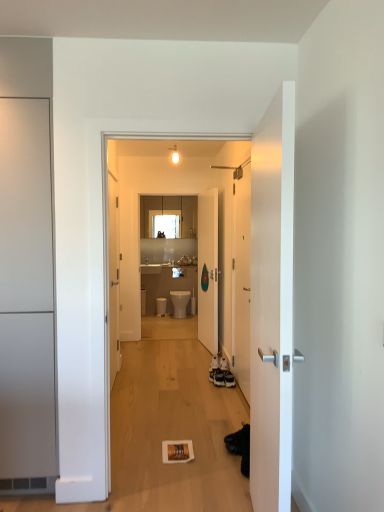
What do you see at coordinates (208, 270) in the screenshot?
I see `white glossy door at center, which is counted as the 1th door, starting from the back` at bounding box center [208, 270].

The width and height of the screenshot is (384, 512). What do you see at coordinates (241, 281) in the screenshot?
I see `white glossy door at center, the 2th door positioned from the back` at bounding box center [241, 281].

Locate an element on the screen. The height and width of the screenshot is (512, 384). white glossy door at center, the 4th door positioned from the left is located at coordinates (241, 281).

This screenshot has width=384, height=512. Identify the location of white glossy sink at center. tap(150, 267).

Considering the sizes of objects white glossy door at center, positioned as the 4th door in front-to-back order, and white matte door at left, which is the 4th door from right to left, in the image provided, who is shorter, white glossy door at center, positioned as the 4th door in front-to-back order, or white matte door at left, which is the 4th door from right to left,?

white glossy door at center, positioned as the 4th door in front-to-back order.

Considering the relative sizes of white glossy door at center, positioned as the 4th door in front-to-back order, and white matte door at left, which appears as the 3th door when viewed from the back, in the image provided, is white glossy door at center, positioned as the 4th door in front-to-back order, thinner than white matte door at left, which appears as the 3th door when viewed from the back,?

Correct, the width of white glossy door at center, positioned as the 4th door in front-to-back order, is less than that of white matte door at left, which appears as the 3th door when viewed from the back.

From the image's perspective, which one is positioned lower, white glossy door at center, placed as the 3th door when sorted from right to left, or white matte door at left, which is the 4th door from right to left?

white glossy door at center, placed as the 3th door when sorted from right to left, appears lower in the image.

Is white glossy door at center, which is counted as the 1th door, starting from the back, facing away from white matte door at left, which appears as the 3th door when viewed from the back?

No, white glossy door at center, which is counted as the 1th door, starting from the back,'s orientation is not away from white matte door at left, which appears as the 3th door when viewed from the back.

From the white glossy door at center, the 2th door positioned from the back, count the 1st door to the left and point to it. Please provide its 2D coordinates.

[(272, 303)]

Considering the points (248, 378) and (283, 132), which point is in front, point (248, 378) or point (283, 132)?

Positioned in front is point (283, 132).

Between white glossy door at center, the 2th door positioned from the back, and white glossy door at right, marked as the 2th door in a right-to-left arrangement, which one has less height?

Standing shorter between the two is white glossy door at right, marked as the 2th door in a right-to-left arrangement.

Looking at their sizes, would you say white glossy door at center, the 4th door positioned from the left, is wider or thinner than white glossy door at right, placed as the third door when sorted from left to right?

Clearly, white glossy door at center, the 4th door positioned from the left, has less width compared to white glossy door at right, placed as the third door when sorted from left to right.

I want to click on sink below the matte wood cabinets at upper center (from a real-world perspective), so click(x=150, y=267).

Is point (159, 266) positioned behind point (183, 217)?

That is False.

Considering the sizes of objects white glossy sink at center and matte wood cabinets at upper center in the image provided, who is wider, white glossy sink at center or matte wood cabinets at upper center?

white glossy sink at center is wider.

From the picture: From a real-world perspective, is white glossy sink at center located beneath matte wood cabinets at upper center?

Correct, in the physical world, white glossy sink at center is lower than matte wood cabinets at upper center.

From the image's perspective, which is below, white matte door at left, which appears as the first door when viewed from the left, or white glossy door at center, positioned as the 4th door in front-to-back order?

From the image's view, white glossy door at center, positioned as the 4th door in front-to-back order, is below.

Is white matte door at left, which is the 4th door from right to left, oriented away from white glossy door at center, which is counted as the 1th door, starting from the back?

That's not correct — white matte door at left, which is the 4th door from right to left, is not looking away from white glossy door at center, which is counted as the 1th door, starting from the back.

How many degrees apart are the facing directions of white matte door at left, which is the 4th door from right to left, and white glossy door at center, which is counted as the second door, starting from the left?

There is a 79.5-degree angle between the facing directions of white matte door at left, which is the 4th door from right to left, and white glossy door at center, which is counted as the second door, starting from the left.

Is white matte door at left, which is the 4th door from right to left, inside or outside of white glossy door at center, positioned as the 4th door in front-to-back order?

white matte door at left, which is the 4th door from right to left, exists outside the volume of white glossy door at center, positioned as the 4th door in front-to-back order.

Is white glossy door at right, acting as the 4th door starting from the back, turned away from white glossy sink at center?

white glossy door at right, acting as the 4th door starting from the back, is not turned away from white glossy sink at center.

Consider the image. Is white glossy door at right, placed as the third door when sorted from left to right, outside of white glossy sink at center?

white glossy door at right, placed as the third door when sorted from left to right, is positioned outside white glossy sink at center.

In terms of size, does white glossy door at right, placed as the third door when sorted from left to right, appear bigger or smaller than white glossy sink at center?

white glossy door at right, placed as the third door when sorted from left to right, is bigger than white glossy sink at center.

Can you confirm if white glossy door at right, placed as the first door when sorted from front to back, is positioned to the left of white glossy sink at center?

No.

Is the depth of white glossy sink at center greater than that of white glossy toilet at center?

Yes, white glossy sink at center is behind white glossy toilet at center.

Looking at this image, which point is more distant from viewer, [156,264] or [180,304]?

The point [156,264] is farther from the camera.

This screenshot has height=512, width=384. Find the location of `toilet on the right of white glossy sink at center`. toilet on the right of white glossy sink at center is located at coordinates (180, 302).

From the image's perspective, which object appears higher, matte wood cabinets at upper center or white glossy toilet at center?

matte wood cabinets at upper center, from the image's perspective.

Does point (140, 208) appear closer or farther from the camera than point (172, 296)?

Point (140, 208) is farther from the camera than point (172, 296).

How different are the orientations of matte wood cabinets at upper center and white glossy toilet at center in degrees?

The facing directions of matte wood cabinets at upper center and white glossy toilet at center are 0.71 degrees apart.

This screenshot has width=384, height=512. In order to click on the 2nd door above the white glossy door at center, placed as the 3th door when sorted from right to left (from a real-world perspective) in this screenshot , I will do `click(26, 298)`.

At what (x,y) coordinates should I click in order to perform the action: click on the 2nd door located beneath the white glossy door at center, the 2th door positioned from the back (from a real-world perspective). Please return your answer as a coordinate pair (x, y). The width and height of the screenshot is (384, 512). Looking at the image, I should click on (272, 303).

Considering their positions, is matte wood cabinets at upper center positioned closer to white glossy door at center, the 2th door positioned from the back, than white glossy sink at center?

matte wood cabinets at upper center lies closer to white glossy door at center, the 2th door positioned from the back, than the other object.

When comparing their distances from white glossy toilet at center, does white glossy door at center, the third door in the front-to-back sequence, or white glossy door at right, placed as the third door when sorted from left to right, seem closer?

white glossy door at center, the third door in the front-to-back sequence, lies closer to white glossy toilet at center than the other object.

Which object lies nearer to the anchor point matte wood cabinets at upper center, white glossy toilet at center or white glossy sink at center?

white glossy sink at center is positioned closer to the anchor matte wood cabinets at upper center.

When comparing their distances from white glossy door at right, marked as the 2th door in a right-to-left arrangement, does white glossy toilet at center or matte wood cabinets at upper center seem further?

Among the two, matte wood cabinets at upper center is located further to white glossy door at right, marked as the 2th door in a right-to-left arrangement.

Estimate the real-world distances between objects in this image. Which object is closer to white glossy toilet at center, white glossy door at center, placed as the 3th door when sorted from right to left, or matte wood cabinets at upper center?

white glossy door at center, placed as the 3th door when sorted from right to left, lies closer to white glossy toilet at center than the other object.

In the scene shown: From the image, which object appears to be nearer to white glossy door at center, the 4th door positioned from the left, white glossy door at right, placed as the first door when sorted from front to back, or white matte door at left, placed as the 2th door when sorted from front to back?

white glossy door at right, placed as the first door when sorted from front to back, lies closer to white glossy door at center, the 4th door positioned from the left, than the other object.

Which object lies nearer to the anchor point white glossy sink at center, white matte door at left, which appears as the first door when viewed from the left, or white glossy door at right, placed as the first door when sorted from front to back?

Based on the image, white matte door at left, which appears as the first door when viewed from the left, appears to be nearer to white glossy sink at center.

Estimate the real-world distances between objects in this image. Which object is further from white glossy door at center, which is counted as the 1th door, starting from the back, white glossy door at center, the 2th door positioned from the back, or white glossy sink at center?

Based on the image, white glossy sink at center appears to be further to white glossy door at center, which is counted as the 1th door, starting from the back.

Locate an element on the screen. toilet between white glossy door at right, placed as the first door when sorted from front to back, and white glossy sink at center in the front-back direction is located at coordinates (180, 302).

You are a GUI agent. You are given a task and a screenshot of the screen. Output one action in this format:
    pyautogui.click(x=<x>, y=<y>)
    Task: Click on the sink between white glossy door at right, placed as the third door when sorted from left to right, and matte wood cabinets at upper center in the front-back direction
    Image resolution: width=384 pixels, height=512 pixels.
    Given the screenshot: What is the action you would take?
    pyautogui.click(x=150, y=267)

Where is `toilet between white glossy door at center, positioned as the 4th door in front-to-back order, and white glossy sink at center in the front-back direction`? This screenshot has height=512, width=384. toilet between white glossy door at center, positioned as the 4th door in front-to-back order, and white glossy sink at center in the front-back direction is located at coordinates (180, 302).

The height and width of the screenshot is (512, 384). I want to click on toilet between white matte door at left, which is the 4th door from right to left, and matte wood cabinets at upper center in the front-back direction, so click(180, 302).